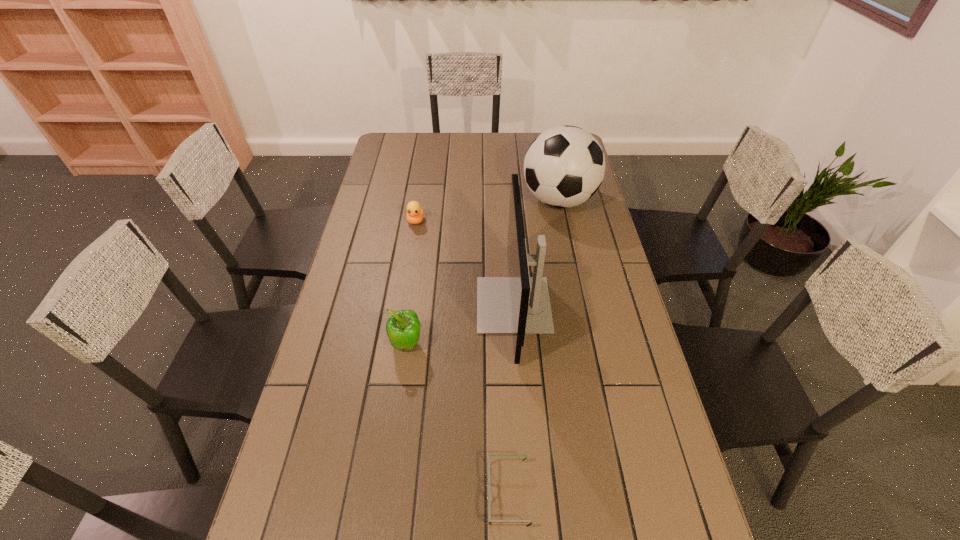
Where is `vacant space located 0.230m on the right of the third tallest object`? The image size is (960, 540). vacant space located 0.230m on the right of the third tallest object is located at coordinates (504, 345).

Locate an element on the screen. free space located 0.310m on the face of the duckling is located at coordinates (404, 291).

This screenshot has width=960, height=540. Find the location of `vacant space located 0.330m on the lens of the spectacles`. vacant space located 0.330m on the lens of the spectacles is located at coordinates pyautogui.click(x=340, y=494).

I want to click on free space located on the lens of the spectacles, so click(390, 494).

The image size is (960, 540). I want to click on free region located on the lens of the spectacles, so click(x=403, y=494).

Where is `object at the right edge`? The width and height of the screenshot is (960, 540). object at the right edge is located at coordinates (564, 166).

Where is `vacant space at the far edge of the desktop`? Image resolution: width=960 pixels, height=540 pixels. vacant space at the far edge of the desktop is located at coordinates (506, 153).

Identify the location of free space at the left edge. This screenshot has width=960, height=540. (282, 512).

Where is `free space at the right edge`? free space at the right edge is located at coordinates click(662, 434).

The image size is (960, 540). I want to click on free region at the far left corner, so pyautogui.click(x=388, y=151).